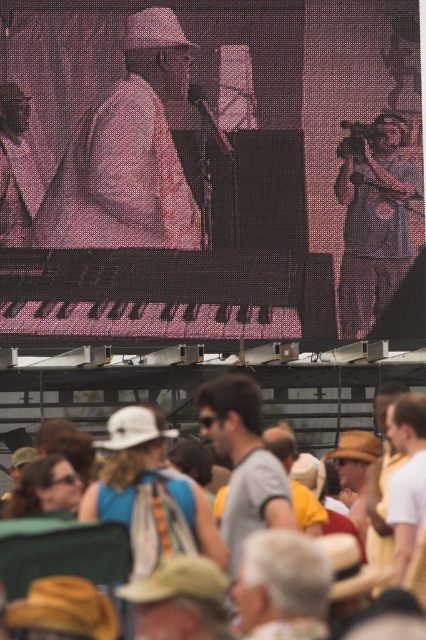
Question: Among these objects, which one is farthest from the camera?

Choices:
 (A) matte white hat at center
 (B) matte purple camera at upper right

Answer: (B)

Question: Is matte white hat at center to the right of matte purple camera at upper right from the viewer's perspective?

Choices:
 (A) yes
 (B) no

Answer: (B)

Question: Which point is closer to the camera taking this photo?

Choices:
 (A) [46, 212]
 (B) [137, 472]
 (C) [291, 516]
 (D) [397, 179]

Answer: (C)

Question: Is matte white hat at center to the right of matte purple camera at upper right from the viewer's perspective?

Choices:
 (A) yes
 (B) no

Answer: (B)

Question: Does matte white hat at center lie in front of white woven hat at center?

Choices:
 (A) yes
 (B) no

Answer: (B)

Question: Which point is farther to the camera?

Choices:
 (A) matte white hat at center
 (B) matte purple camera at upper right

Answer: (B)